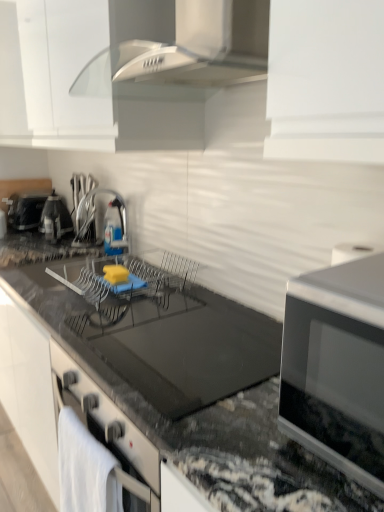
Question: Would you say satin nickel faucet at center, acting as the first appliance starting from the right, contains black glass countertop at center?

Choices:
 (A) yes
 (B) no

Answer: (B)

Question: Is satin nickel faucet at center, which is the third appliance in back-to-front order, far from black glass countertop at center?

Choices:
 (A) no
 (B) yes

Answer: (A)

Question: Considering the relative sizes of satin nickel faucet at center, which is the third appliance in back-to-front order, and black glass countertop at center in the image provided, is satin nickel faucet at center, which is the third appliance in back-to-front order, smaller than black glass countertop at center?

Choices:
 (A) no
 (B) yes

Answer: (B)

Question: From a real-world perspective, is satin nickel faucet at center, acting as the first appliance starting from the right, located higher than black glass countertop at center?

Choices:
 (A) no
 (B) yes

Answer: (B)

Question: From the image's perspective, would you say satin nickel faucet at center, placed as the 3th appliance when sorted from left to right, is shown under black glass countertop at center?

Choices:
 (A) yes
 (B) no

Answer: (B)

Question: Does satin nickel faucet at center, which ranks as the 1th appliance in front-to-back order, turn towards black glass countertop at center?

Choices:
 (A) yes
 (B) no

Answer: (B)

Question: Does metallic silver kettle at left, the 2th appliance when ordered from back to front, have a larger size compared to white matte cabinetry at upper center?

Choices:
 (A) no
 (B) yes

Answer: (A)

Question: Is white matte cabinetry at upper center at the back of metallic silver kettle at left, the 2th appliance when ordered from back to front?

Choices:
 (A) no
 (B) yes

Answer: (A)

Question: Is metallic silver kettle at left, the 2th appliance when ordered from back to front, in front of white matte cabinetry at upper center?

Choices:
 (A) yes
 (B) no

Answer: (B)

Question: From a real-world perspective, is metallic silver kettle at left, the 2th appliance viewed from the left, beneath white matte cabinetry at upper center?

Choices:
 (A) yes
 (B) no

Answer: (A)

Question: Is metallic silver kettle at left, the second appliance in the right-to-left sequence, next to white matte cabinetry at upper center?

Choices:
 (A) yes
 (B) no

Answer: (B)

Question: From the image's perspective, is metallic silver kettle at left, the second appliance in the right-to-left sequence, on white matte cabinetry at upper center?

Choices:
 (A) yes
 (B) no

Answer: (B)

Question: Can you confirm if metallic silver kettle at left, the 2th appliance viewed from the left, is taller than satin nickel faucet at center, acting as the first appliance starting from the right?

Choices:
 (A) yes
 (B) no

Answer: (B)